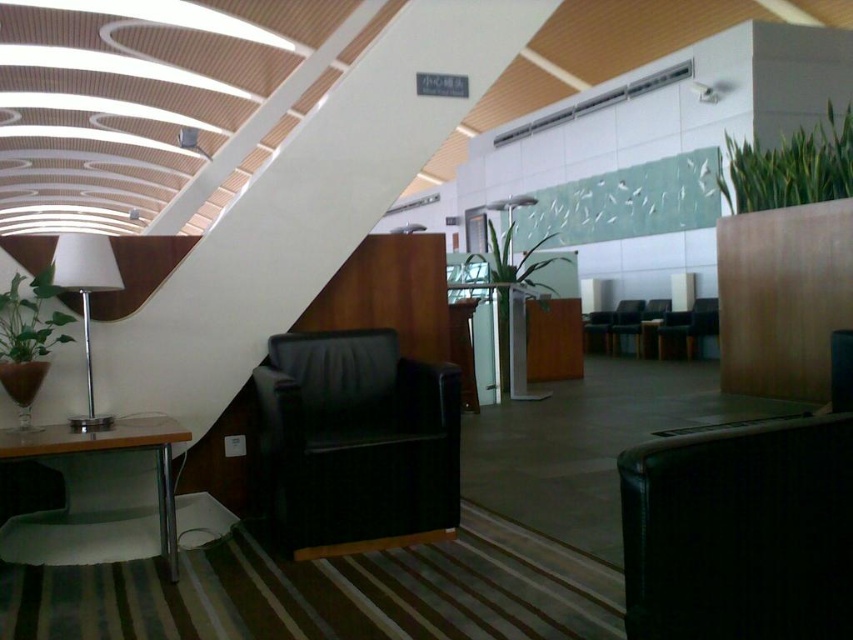
Describe the element at coordinates (86, 298) in the screenshot. I see `white matte lamp at left` at that location.

Can you confirm if white matte lamp at left is bigger than green leafy plant at center?

Incorrect, white matte lamp at left is not larger than green leafy plant at center.

Is point (85, 292) behind point (496, 240)?

No.

What are the coordinates of `white matte lamp at left` in the screenshot? It's located at (86, 298).

From the picture: Is green leafy plant at upper right shorter than green matte plant at left?

In fact, green leafy plant at upper right may be taller than green matte plant at left.

Who is taller, green leafy plant at upper right or green matte plant at left?

With more height is green leafy plant at upper right.

Does point (816, 157) lie behind point (24, 336)?

Yes, it is behind point (24, 336).

Image resolution: width=853 pixels, height=640 pixels. I want to click on green leafy plant at upper right, so click(x=791, y=168).

Is green leafy plant at upper right bigger than metallic silver table at lower left?

Yes.

Measure the distance from green leafy plant at upper right to metallic silver table at lower left.

They are 5.57 meters apart.

Where is `green leafy plant at upper right`? The height and width of the screenshot is (640, 853). green leafy plant at upper right is located at coordinates coord(791,168).